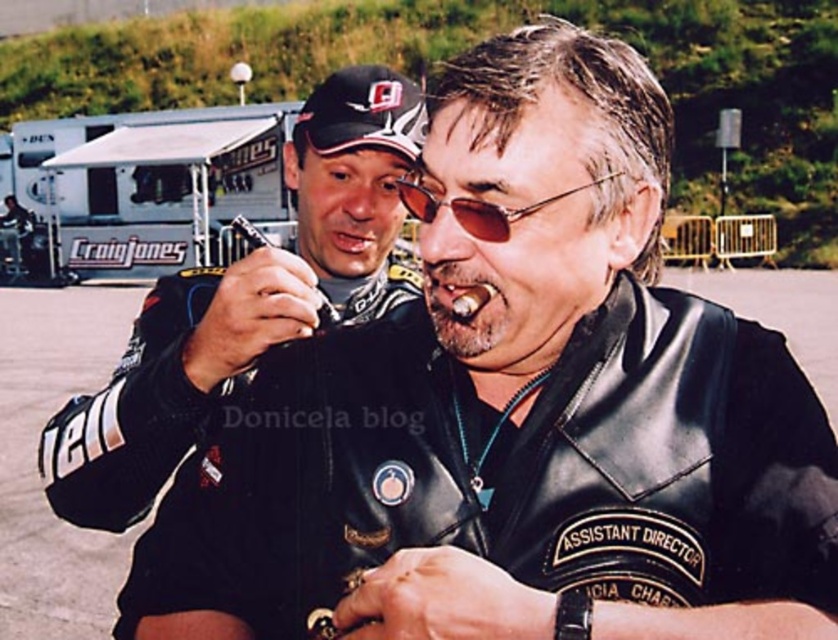
Question: Estimate the real-world distances between objects in this image. Which object is closer to the black leather jacket at center?

Choices:
 (A) white canvas trailer at upper left
 (B) sunglasses at center

Answer: (B)

Question: Is black leather jacket at left further to the viewer compared to white canvas trailer at upper left?

Choices:
 (A) yes
 (B) no

Answer: (B)

Question: Is white canvas trailer at upper left above sunglasses at center?

Choices:
 (A) no
 (B) yes

Answer: (B)

Question: Which point is farther from the camera taking this photo?

Choices:
 (A) (89, 275)
 (B) (370, 332)
 (C) (423, 202)
 (D) (306, 131)

Answer: (A)

Question: Is black leather jacket at left wider than sunglasses at center?

Choices:
 (A) no
 (B) yes

Answer: (B)

Question: Among these points, which one is nearest to the camera?

Choices:
 (A) (303, 305)
 (B) (389, 99)

Answer: (A)